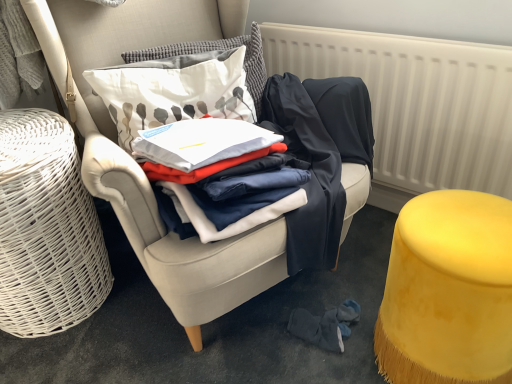
Question: Is white textured radiator at upper right with white printed cushion at upper center, positioned as the 1th pillow in bottom-to-top order?

Choices:
 (A) no
 (B) yes

Answer: (A)

Question: Does white textured radiator at upper right have a lesser height compared to white printed cushion at upper center, positioned as the 1th pillow in bottom-to-top order?

Choices:
 (A) no
 (B) yes

Answer: (A)

Question: Is white textured radiator at upper right in front of white printed cushion at upper center, the 2th pillow when ordered from top to bottom?

Choices:
 (A) yes
 (B) no

Answer: (A)

Question: From a real-world perspective, is white textured radiator at upper right on top of white printed cushion at upper center, the 2th pillow when ordered from top to bottom?

Choices:
 (A) no
 (B) yes

Answer: (A)

Question: From the image's perspective, is white textured radiator at upper right under white printed cushion at upper center, the 2th pillow when ordered from top to bottom?

Choices:
 (A) no
 (B) yes

Answer: (B)

Question: Would you say velvet armchair at center is inside or outside white textured radiator at upper right?

Choices:
 (A) outside
 (B) inside

Answer: (A)

Question: Is velvet armchair at center taller or shorter than white textured radiator at upper right?

Choices:
 (A) short
 (B) tall

Answer: (B)

Question: Looking at the image, does velvet armchair at center seem bigger or smaller compared to white textured radiator at upper right?

Choices:
 (A) small
 (B) big

Answer: (B)

Question: Is velvet armchair at center in front of or behind white textured radiator at upper right in the image?

Choices:
 (A) front
 (B) behind

Answer: (A)

Question: From their relative heights in the image, would you say white cotton shirt at center is taller or shorter than velvet armchair at center?

Choices:
 (A) tall
 (B) short

Answer: (B)

Question: Based on their sizes in the image, would you say white cotton shirt at center is bigger or smaller than velvet armchair at center?

Choices:
 (A) small
 (B) big

Answer: (A)

Question: Is white cotton shirt at center situated inside velvet armchair at center or outside?

Choices:
 (A) outside
 (B) inside

Answer: (B)

Question: Is point (246, 175) positioned closer to the camera than point (87, 34)?

Choices:
 (A) farther
 (B) closer

Answer: (B)

Question: From the image's perspective, is white wicker basket at left located above or below velvet yellow stool at lower right?

Choices:
 (A) below
 (B) above

Answer: (B)

Question: Considering the relative positions of white wicker basket at left and velvet yellow stool at lower right in the image provided, is white wicker basket at left to the left or to the right of velvet yellow stool at lower right?

Choices:
 (A) left
 (B) right

Answer: (A)